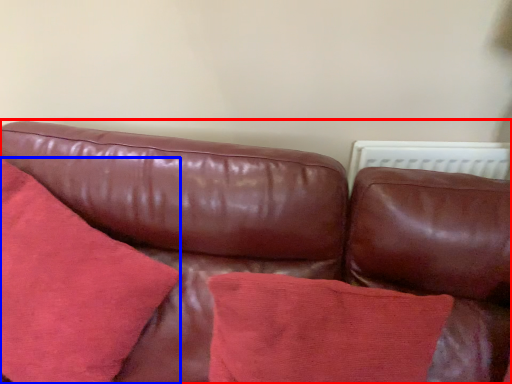
Question: Which object is further to the camera taking this photo, studio couch (highlighted by a red box) or throw pillow (highlighted by a blue box)?

Choices:
 (A) studio couch
 (B) throw pillow

Answer: (B)